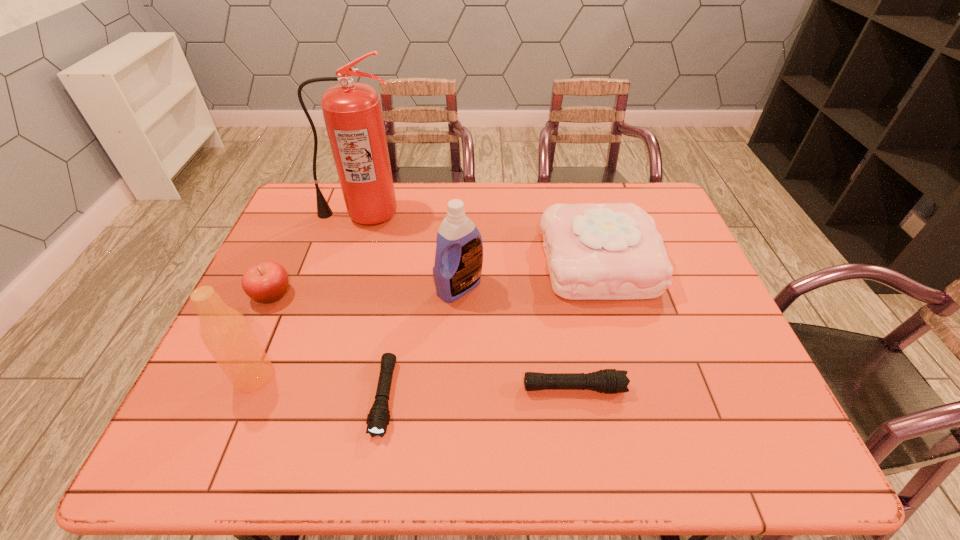
This screenshot has height=540, width=960. I want to click on object located in the right edge section of the desktop, so click(612, 251).

Locate an element on the screen. object at the far left corner is located at coordinates (352, 112).

This screenshot has height=540, width=960. Identify the location of object at the near left corner. (226, 333).

Find the location of a particular element. This screenshot has height=540, width=960. free space at the far edge is located at coordinates (480, 202).

In the image, there is a desktop. Where is `vacant space at the near edge`? The width and height of the screenshot is (960, 540). vacant space at the near edge is located at coordinates (676, 397).

Where is `free space at the far left corner of the desktop`? This screenshot has width=960, height=540. free space at the far left corner of the desktop is located at coordinates (296, 207).

Identify the location of vacant space at the near left corner of the desktop. The image size is (960, 540). (225, 389).

This screenshot has height=540, width=960. Identify the location of vacant space at the far right corner of the desktop. (627, 182).

Locate an element on the screen. The image size is (960, 540). free region at the near right corner of the desktop is located at coordinates (725, 410).

Where is `blank region between the beer bottle and the taller flashlight`? The image size is (960, 540). blank region between the beer bottle and the taller flashlight is located at coordinates [x=414, y=382].